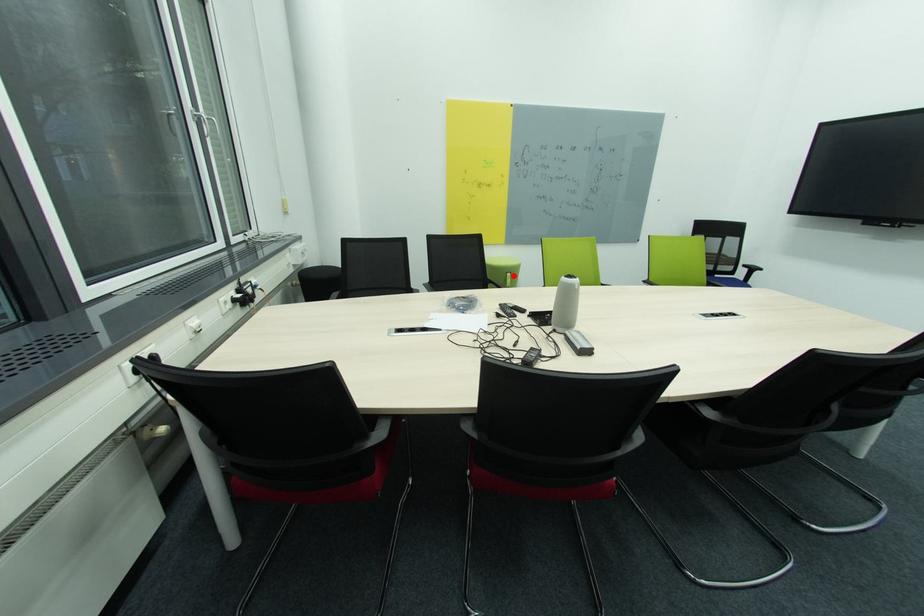
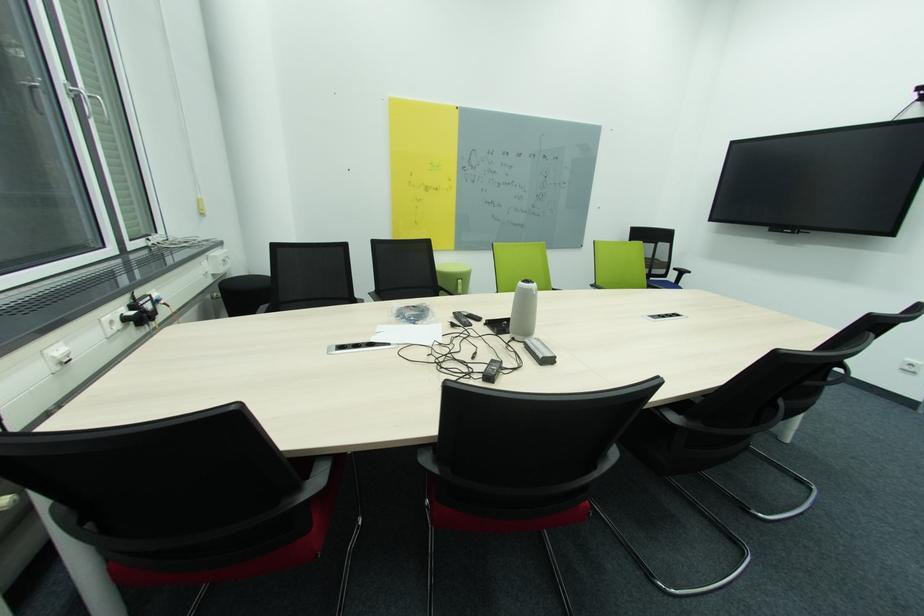
Where in the second image is the point corresponding to the highlighted location from the first image?

(465, 282)